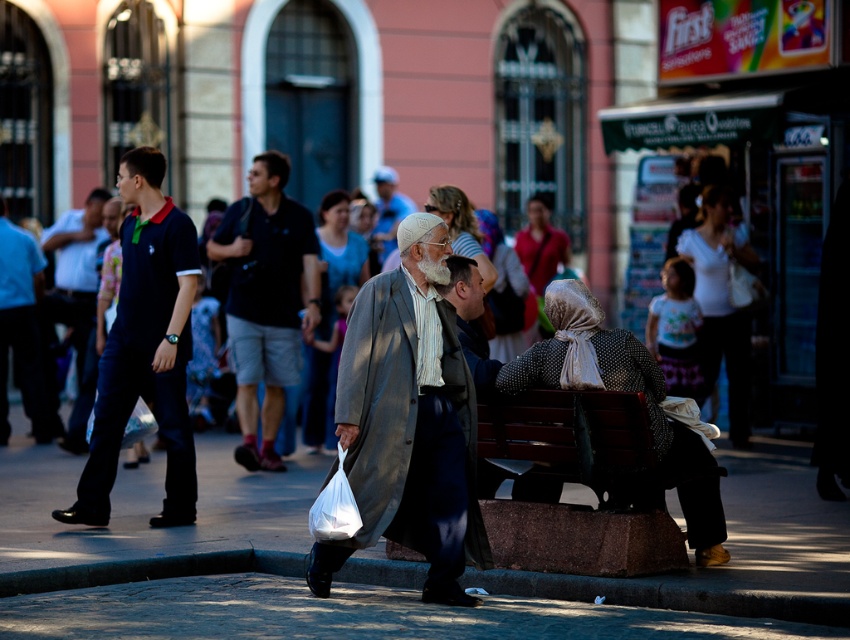
Is the position of dark blue cotton polo shirt at left less distant than that of matte gray coat at center?

Yes, it is in front of matte gray coat at center.

Is point (129, 195) positioned in front of point (319, 387)?

Yes, it is in front of point (319, 387).

Image resolution: width=850 pixels, height=640 pixels. Find the location of `dark blue cotton polo shirt at left`. dark blue cotton polo shirt at left is located at coordinates (145, 346).

Is polka dot fabric headscarf at center positioned at the back of white cotton shirt at upper right?

That is False.

Is polka dot fabric headscarf at center below white cotton shirt at upper right?

Yes, polka dot fabric headscarf at center is below white cotton shirt at upper right.

Does point (545, 340) come farther from viewer compared to point (745, 392)?

No, (545, 340) is closer to viewer.

Where is `polka dot fabric headscarf at center`? The width and height of the screenshot is (850, 640). polka dot fabric headscarf at center is located at coordinates (601, 369).

Can you confirm if smooth concrete pavement at center is thinner than dark gray coat at center?

No.

Find the location of a particular element. smooth concrete pavement at center is located at coordinates (381, 561).